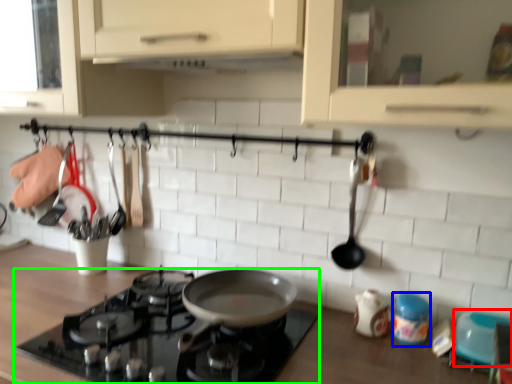
Question: Which object is the farthest from appliance (highlighted by a red box)? Choose among these: appliance (highlighted by a blue box) or gas stove (highlighted by a green box).

Choices:
 (A) appliance
 (B) gas stove

Answer: (B)